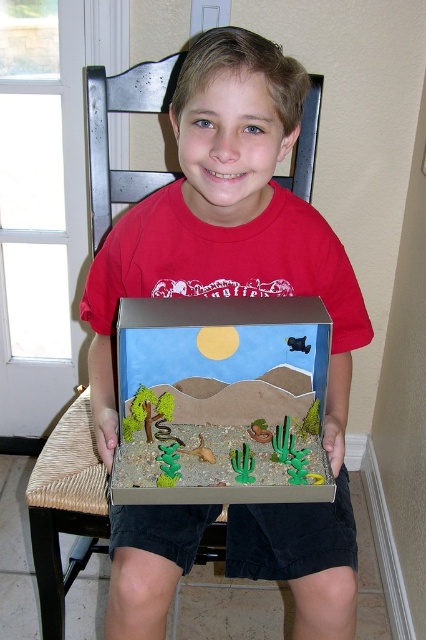
Does matte cardboard box at center appear under cardboard diorama at center?

No, matte cardboard box at center is not below cardboard diorama at center.

Who is shorter, matte cardboard box at center or cardboard diorama at center?

cardboard diorama at center

Measure the distance between point (299,577) and camera.

The distance of point (299,577) from camera is 35.35 inches.

Locate an element on the screen. matte cardboard box at center is located at coordinates (242, 292).